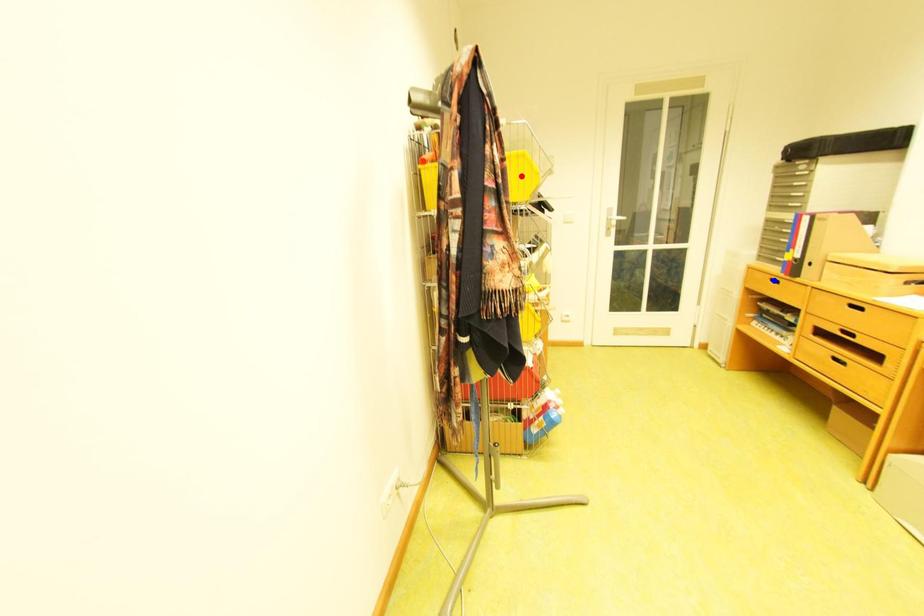
Question: Two points are marked on the image. Which point is closer to the camera?

Choices:
 (A) Blue point is closer.
 (B) Red point is closer.

Answer: (B)